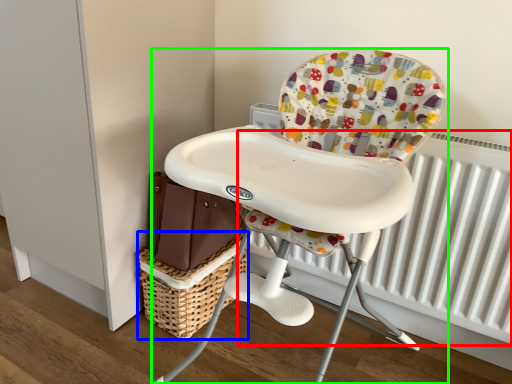
Question: Based on their relative distances, which object is nearer to radiator (highlighted by a red box)? Choose from basket (highlighted by a blue box) and chair (highlighted by a green box).

Choices:
 (A) basket
 (B) chair

Answer: (B)